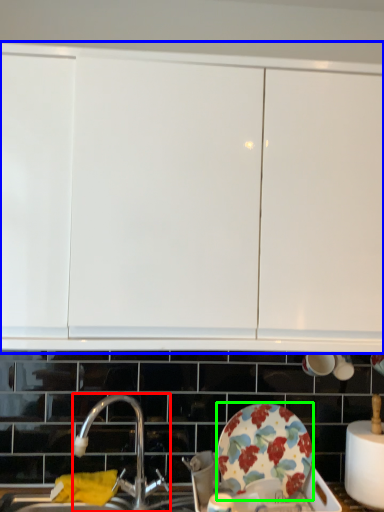
Question: Which object is positioned farthest from tap (highlighted by a red box)? Select from cabinetry (highlighted by a blue box) and plate (highlighted by a green box).

Choices:
 (A) cabinetry
 (B) plate

Answer: (A)